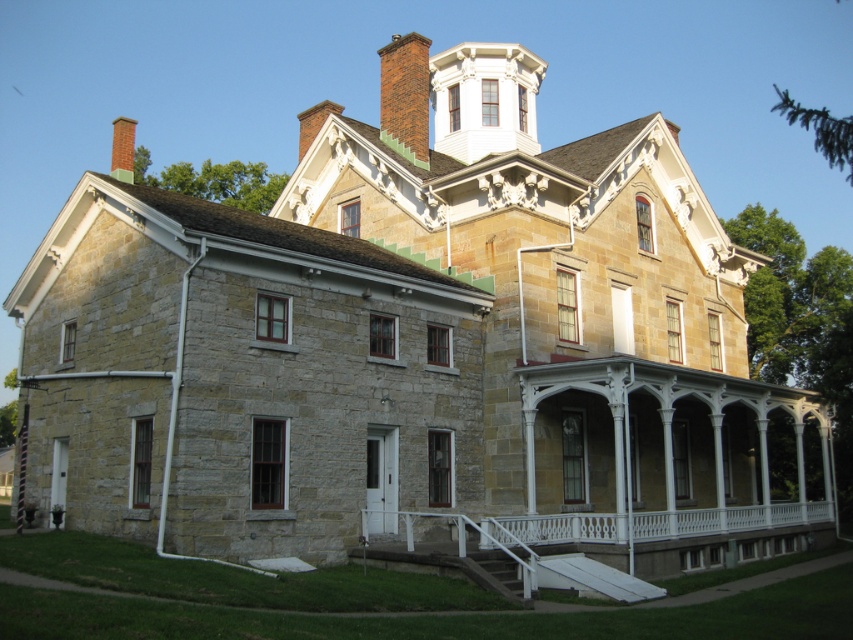
Consider the image. Can you confirm if red brick chimney at upper center is thinner than brick chimney at upper left?

Correct, red brick chimney at upper center's width is less than brick chimney at upper left's.

Which is below, red brick chimney at upper center or brick chimney at upper left?

Positioned lower is brick chimney at upper left.

Does point (418, 70) come farther from viewer compared to point (131, 177)?

Yes, point (418, 70) is behind point (131, 177).

The width and height of the screenshot is (853, 640). Find the location of `red brick chimney at upper center`. red brick chimney at upper center is located at coordinates (405, 90).

Can you confirm if white painted wood porch at lower center is positioned to the left of brick chimney at upper left?

Incorrect, white painted wood porch at lower center is not on the left side of brick chimney at upper left.

In the scene shown: Can you confirm if white painted wood porch at lower center is positioned above brick chimney at upper left?

Incorrect, white painted wood porch at lower center is not positioned above brick chimney at upper left.

Between point (672, 572) and point (122, 152), which one is positioned behind?

Point (122, 152)

At what (x,y) coordinates should I click in order to perform the action: click on white painted wood porch at lower center. Please return your answer as a coordinate pair (x, y). The height and width of the screenshot is (640, 853). Looking at the image, I should click on (662, 536).

Which is above, white painted wood porch at lower center or red brick chimney at upper center?

red brick chimney at upper center is above.

Between white painted wood porch at lower center and red brick chimney at upper center, which one has more height?

Standing taller between the two is red brick chimney at upper center.

Does point (552, 541) come farther from viewer compared to point (402, 99)?

That is False.

The image size is (853, 640). Find the location of `white painted wood porch at lower center`. white painted wood porch at lower center is located at coordinates (662, 536).